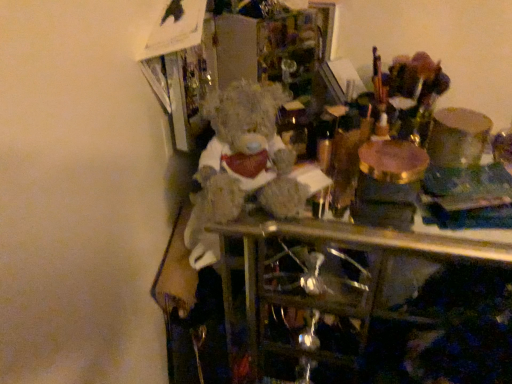
Question: Does fuzzy fabric teddy bear at center turn towards translucent glass wine bottle at center?

Choices:
 (A) no
 (B) yes

Answer: (A)

Question: Can you confirm if fuzzy fabric teddy bear at center is positioned to the right of translucent glass wine bottle at center?

Choices:
 (A) no
 (B) yes

Answer: (A)

Question: Is fuzzy fabric teddy bear at center in contact with translucent glass wine bottle at center?

Choices:
 (A) yes
 (B) no

Answer: (B)

Question: Is fuzzy fabric teddy bear at center positioned far away from translucent glass wine bottle at center?

Choices:
 (A) yes
 (B) no

Answer: (B)

Question: Is fuzzy fabric teddy bear at center positioned with its back to translucent glass wine bottle at center?

Choices:
 (A) no
 (B) yes

Answer: (A)

Question: Can you confirm if fuzzy fabric teddy bear at center is bigger than translucent glass wine bottle at center?

Choices:
 (A) no
 (B) yes

Answer: (B)

Question: Does translucent glass wine bottle at center appear on the right side of fuzzy fabric teddy bear at center?

Choices:
 (A) no
 (B) yes

Answer: (B)

Question: Does translucent glass wine bottle at center contain fuzzy fabric teddy bear at center?

Choices:
 (A) no
 (B) yes

Answer: (A)

Question: Does translucent glass wine bottle at center appear on the left side of fuzzy fabric teddy bear at center?

Choices:
 (A) yes
 (B) no

Answer: (B)

Question: Is translucent glass wine bottle at center aimed at fuzzy fabric teddy bear at center?

Choices:
 (A) no
 (B) yes

Answer: (B)

Question: Is there a large distance between translucent glass wine bottle at center and fuzzy fabric teddy bear at center?

Choices:
 (A) no
 (B) yes

Answer: (A)

Question: Considering the relative sizes of translucent glass wine bottle at center and fuzzy fabric teddy bear at center in the image provided, is translucent glass wine bottle at center taller than fuzzy fabric teddy bear at center?

Choices:
 (A) yes
 (B) no

Answer: (B)

Question: Considering the positions of fuzzy fabric teddy bear at center and translucent glass wine bottle at center in the image, is fuzzy fabric teddy bear at center taller or shorter than translucent glass wine bottle at center?

Choices:
 (A) tall
 (B) short

Answer: (A)